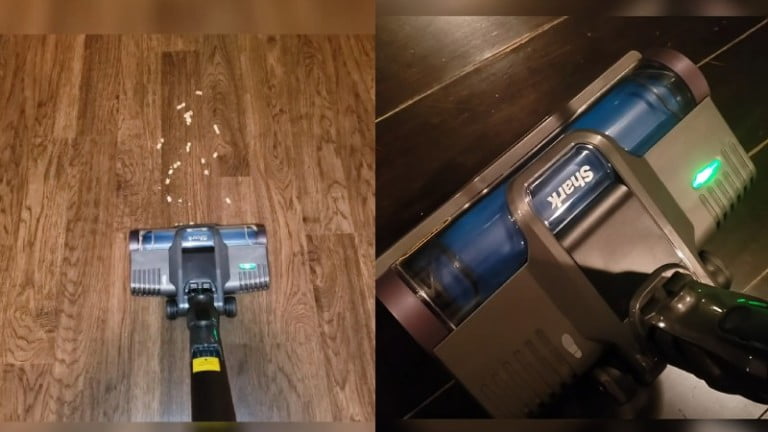
Identify the location of floor. The image size is (768, 432). (295, 188).